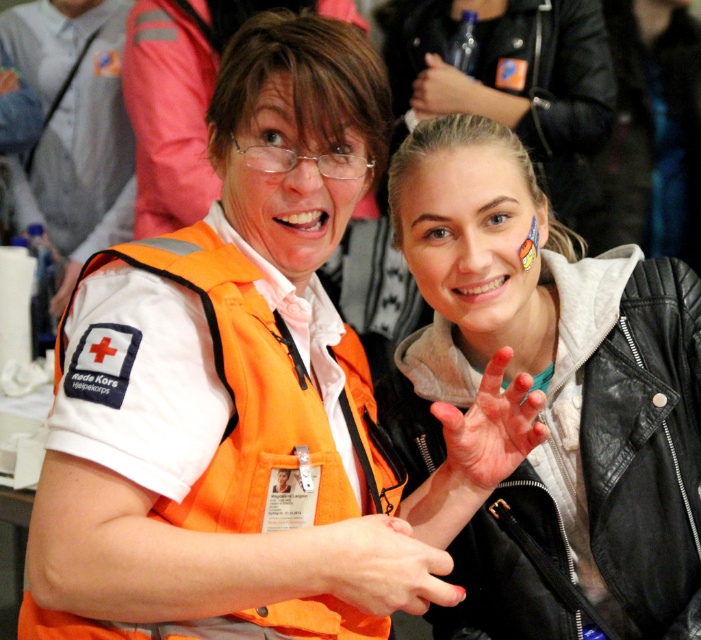
You are an event organizer who needs to ensure proper safety protocols are followed. You observe the orange fabric safety vest at left and the orange matte hand at center in the image. Which object is positioned higher in the scene?

The orange fabric safety vest at left is located above the orange matte hand at center, so it is positioned higher in the scene.

You are a photographer at an event and need to capture a closeup of the matte orange vest at center. However, the matte black hand at upper center is blocking the view. Can you estimate if moving the hand slightly to the side would allow the vest to be fully visible in the frame?

The matte black hand at upper center is larger in size than the matte orange vest at center, so moving it slightly to the side may allow the vest to be fully visible in the frame.